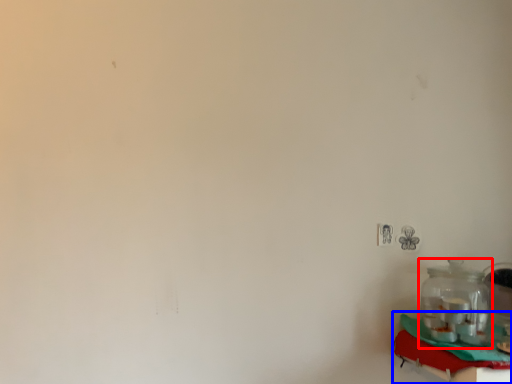
Question: Which point is further to the camera, bottle (highlighted by a red box) or table (highlighted by a blue box)?

Choices:
 (A) bottle
 (B) table

Answer: (A)